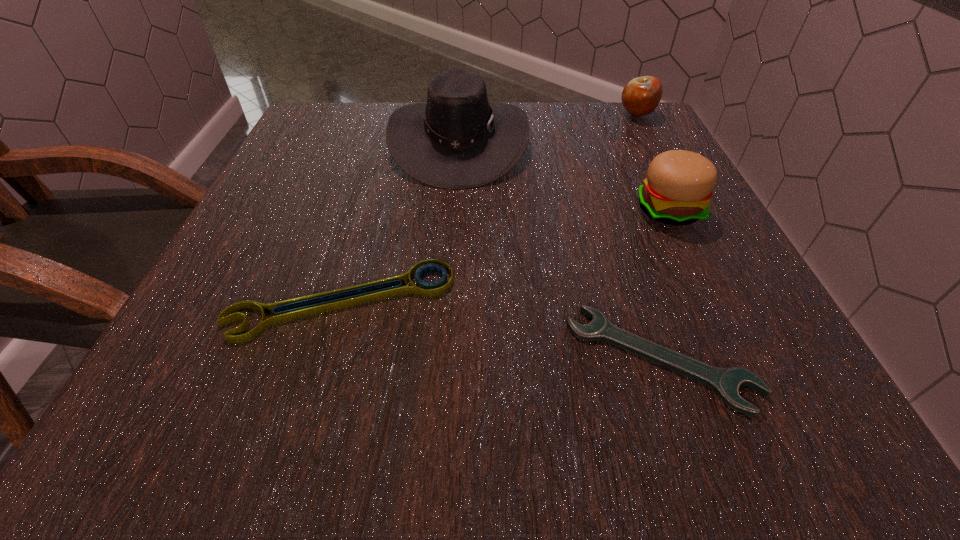
This screenshot has width=960, height=540. I want to click on vacant space at the far edge of the desktop, so click(374, 133).

At what (x,y) coordinates should I click in order to perform the action: click on vacant space at the near edge of the desktop. Please return your answer as a coordinate pair (x, y). This screenshot has width=960, height=540. Looking at the image, I should click on (565, 432).

You are a GUI agent. You are given a task and a screenshot of the screen. Output one action in this format:
    pyautogui.click(x=<x>, y=<y>)
    Task: Click on the free location at the left edge
    The width and height of the screenshot is (960, 540).
    Given the screenshot: What is the action you would take?
    pyautogui.click(x=259, y=211)

Locate an element on the screen. free space at the right edge of the desktop is located at coordinates (658, 297).

Locate an element on the screen. vacant space at the far left corner of the desktop is located at coordinates (358, 118).

Where is `free space at the far right corner of the desktop`? The image size is (960, 540). free space at the far right corner of the desktop is located at coordinates (664, 131).

Where is `free space at the near right corner of the desktop`? free space at the near right corner of the desktop is located at coordinates (766, 403).

Where is `free space between the cowboy hat and the apple`? free space between the cowboy hat and the apple is located at coordinates (548, 129).

Find the location of a particular element. This screenshot has width=960, height=540. free area in between the tallest object and the hamburger is located at coordinates (564, 176).

The width and height of the screenshot is (960, 540). Find the location of `vacant space that's between the right wrench and the third nearest object`. vacant space that's between the right wrench and the third nearest object is located at coordinates (664, 284).